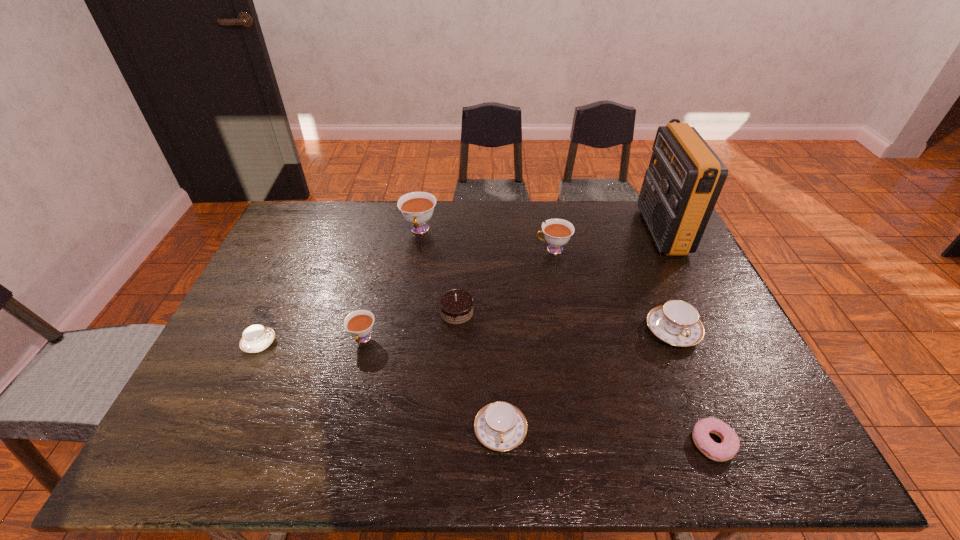
In order to click on free spot that satisfies the following two spatial constraints: 1. on the side with the handle of the rightmost blue teacup; 2. on the side with the handle of the shortest teacup in this screenshot , I will do `click(678, 343)`.

The height and width of the screenshot is (540, 960). I want to click on free space that satisfies the following two spatial constraints: 1. on the side of the fifth teacup from left to right with the handle; 2. on the right side of the pink doughnut, so (589, 443).